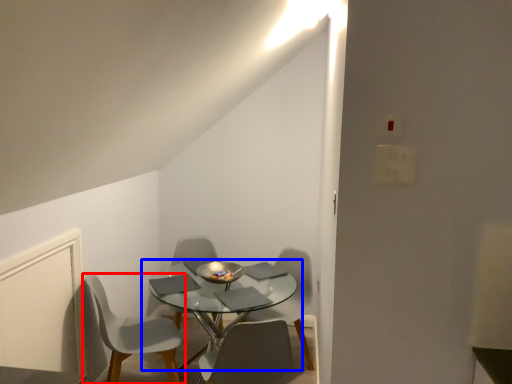
Question: Which point is further to the camera, chair (highlighted by a red box) or coffee table (highlighted by a blue box)?

Choices:
 (A) chair
 (B) coffee table

Answer: (A)